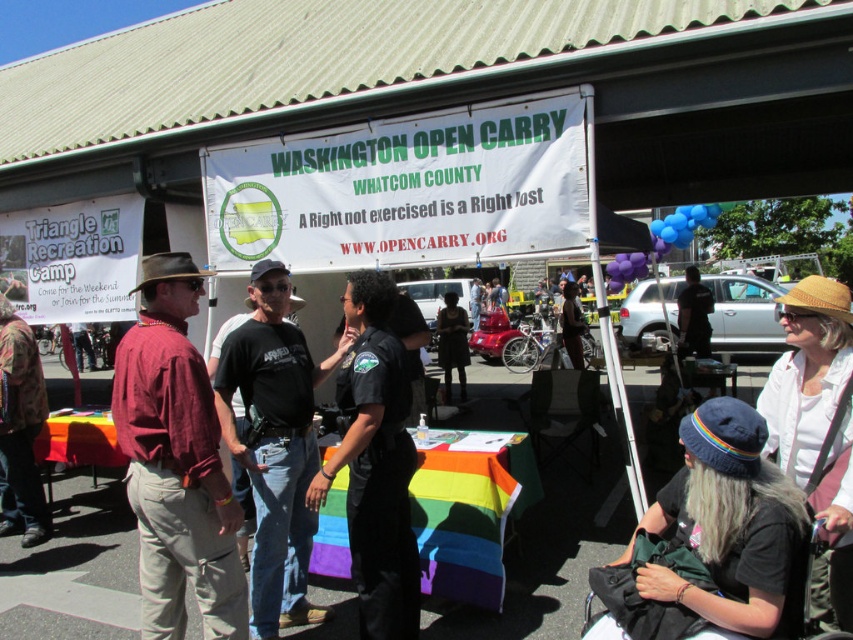
Does maroon linen shirt at center have a lesser height compared to black cotton t-shirt at center?

Yes.

Does maroon linen shirt at center appear on the left side of black cotton t-shirt at center?

Indeed, maroon linen shirt at center is positioned on the left side of black cotton t-shirt at center.

Does point (183, 428) lie behind point (282, 432)?

No, it is not.

Find the location of `maroon linen shirt at center`. maroon linen shirt at center is located at coordinates (177, 461).

Is maroon linen shirt at center wider than black uniform at center?

→ Indeed, maroon linen shirt at center has a greater width compared to black uniform at center.

The width and height of the screenshot is (853, 640). Find the location of `maroon linen shirt at center`. maroon linen shirt at center is located at coordinates (177, 461).

In the scene shown: Can you confirm if black cotton t-shirt at center is positioned above black uniform at center?

Actually, black cotton t-shirt at center is below black uniform at center.

Find the location of a particular element. Image resolution: width=853 pixels, height=640 pixels. black cotton t-shirt at center is located at coordinates (276, 445).

The width and height of the screenshot is (853, 640). Identify the location of black cotton t-shirt at center. (276, 445).